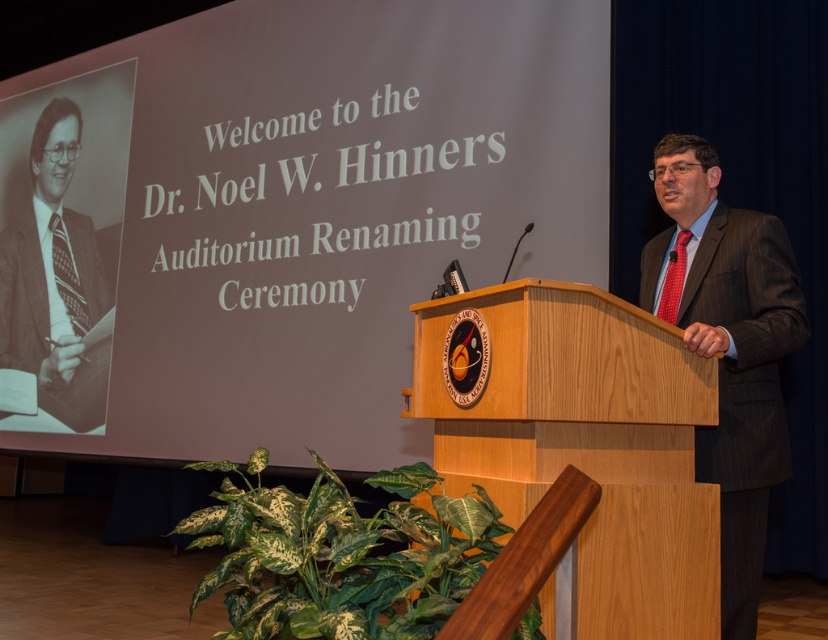
Does wooden podium at center appear over patterned fabric tie at center?

No, wooden podium at center is not above patterned fabric tie at center.

How much distance is there between wooden podium at center and patterned fabric tie at center?

The distance of wooden podium at center from patterned fabric tie at center is 4.71 meters.

At what (x,y) coordinates should I click in order to perform the action: click on wooden podium at center. Please return your answer as a coordinate pair (x, y). Looking at the image, I should click on (586, 445).

The image size is (828, 640). I want to click on wooden podium at center, so click(586, 445).

Between matte black suit at left and patterned fabric tie at center, which one is positioned higher?

Positioned higher is matte black suit at left.

Is the position of matte black suit at left less distant than that of patterned fabric tie at center?

Yes, matte black suit at left is closer to the viewer.

Between point (100, 353) and point (79, 333), which one is positioned behind?

Point (79, 333)

Identify the location of matte black suit at left. (54, 280).

Who is more distant from viewer, (65,276) or (675,310)?

Positioned behind is point (65,276).

Is point (70, 256) behind point (675, 262)?

That is True.

Does point (75, 282) come behind point (660, 305)?

Yes, point (75, 282) is behind point (660, 305).

Locate an element on the screen. patterned fabric tie at center is located at coordinates (66, 276).